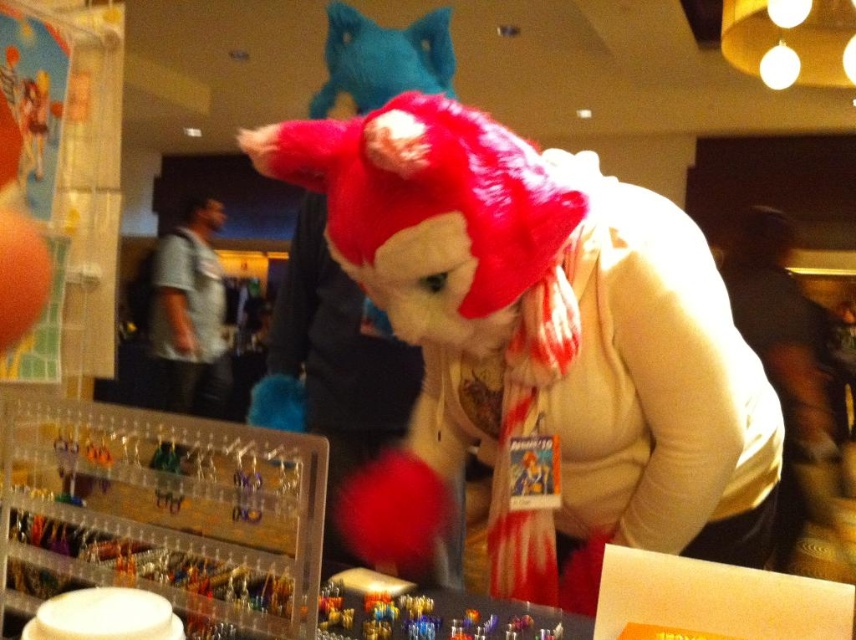
Question: In this image, where is fuzzy red plush toy at center located relative to velvet teal cat at upper center?

Choices:
 (A) right
 (B) left

Answer: (A)

Question: Which is nearer to the fuzzy red plush toy at center?

Choices:
 (A) white soft scarf at center
 (B) velvet teal cat at upper center

Answer: (B)

Question: Which of the following is the farthest from the observer?

Choices:
 (A) fuzzy red plush toy at center
 (B) white soft scarf at center

Answer: (B)

Question: Which of the following is the closest to the observer?

Choices:
 (A) fuzzy red plush toy at center
 (B) velvet teal cat at upper center

Answer: (A)

Question: Does white soft scarf at center have a larger size compared to velvet teal cat at upper center?

Choices:
 (A) no
 (B) yes

Answer: (B)

Question: Can you confirm if fuzzy red plush toy at center is positioned to the right of velvet teal cat at upper center?

Choices:
 (A) no
 (B) yes

Answer: (B)